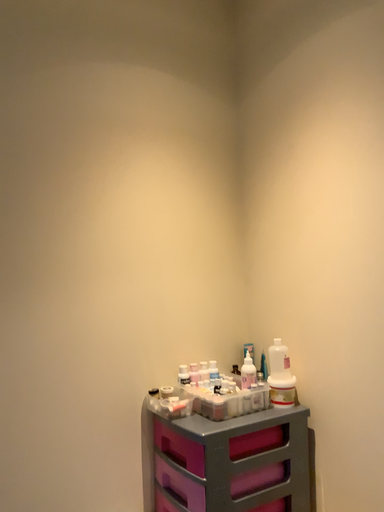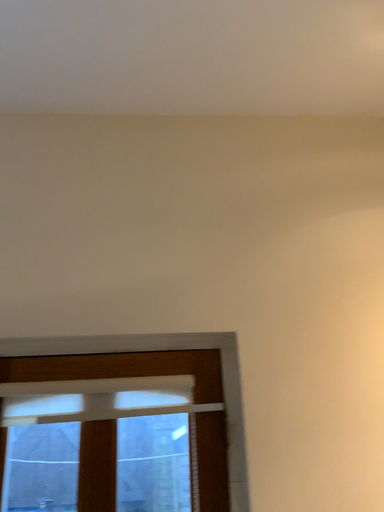
Question: How did the camera likely rotate when shooting the video?

Choices:
 (A) rotated left
 (B) rotated right

Answer: (A)